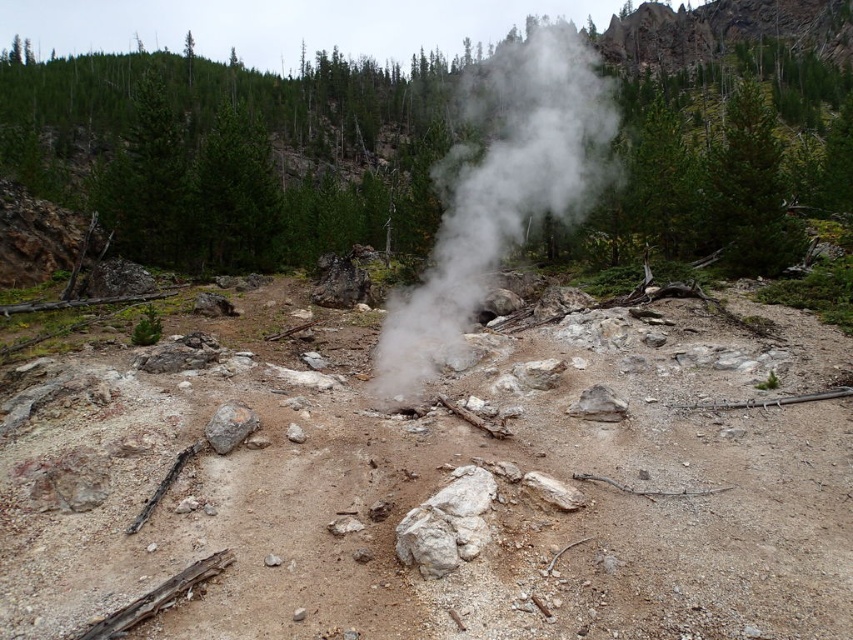
Question: Among these objects, which one is nearest to the camera?

Choices:
 (A) gray rough rock at center
 (B) white vapor at center
 (C) brown sandy dirt track at center

Answer: (C)

Question: Which point is closer to the camera?

Choices:
 (A) (521, 147)
 (B) (230, 442)

Answer: (B)

Question: Does brown sandy dirt track at center appear under white vapor at center?

Choices:
 (A) no
 (B) yes

Answer: (B)

Question: Can you confirm if brown sandy dirt track at center is thinner than white vapor at center?

Choices:
 (A) yes
 (B) no

Answer: (A)

Question: Among these points, which one is nearest to the camera?

Choices:
 (A) (225, 404)
 (B) (585, 416)

Answer: (A)

Question: Is white vapor at center above gray rough rock at center?

Choices:
 (A) no
 (B) yes

Answer: (B)